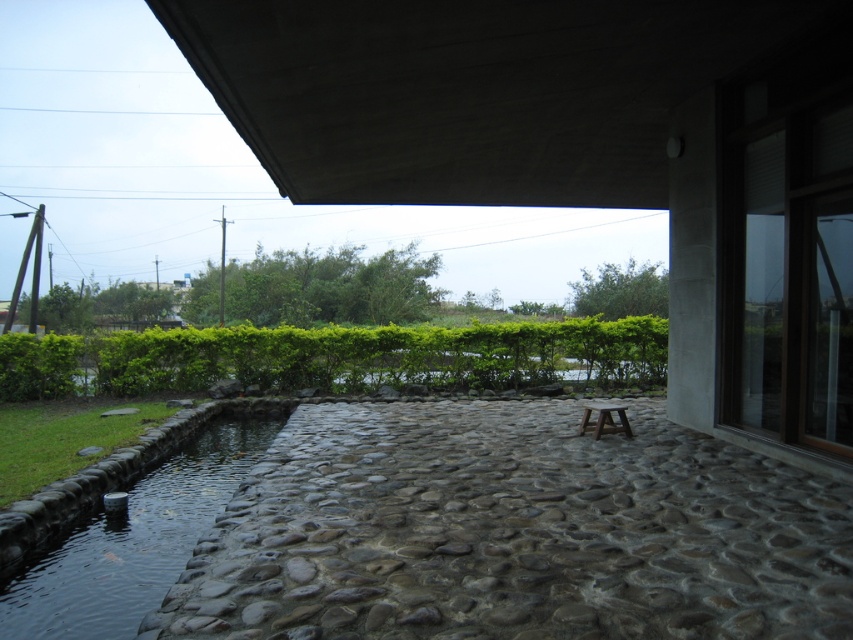
Image resolution: width=853 pixels, height=640 pixels. Describe the element at coordinates (338, 356) in the screenshot. I see `green leafy hedge at center` at that location.

Who is lower down, green leafy hedge at center or clear water at pond left?

Positioned lower is clear water at pond left.

Is point (312, 385) less distant than point (128, 592)?

That is False.

This screenshot has height=640, width=853. In order to click on green leafy hedge at center in this screenshot , I will do `click(338, 356)`.